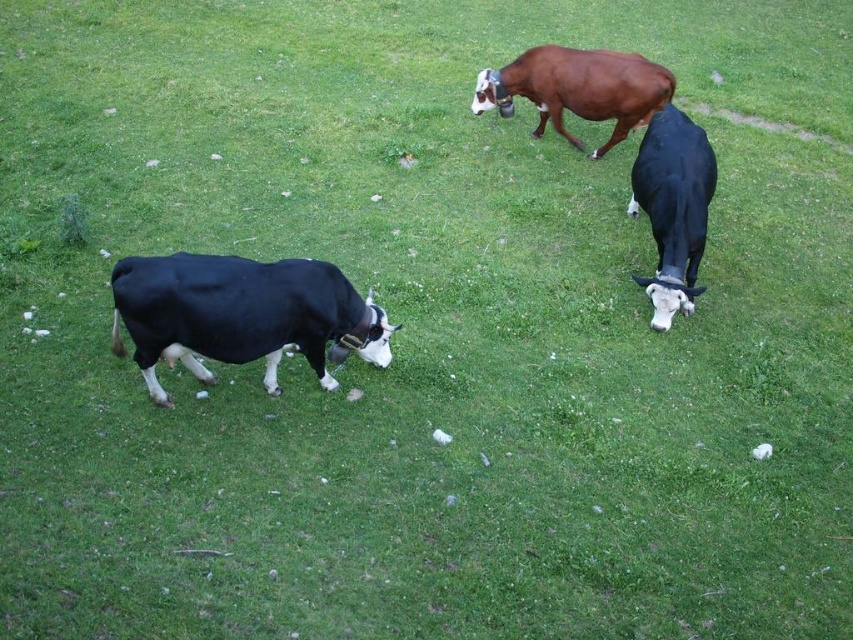
You are a farmer who needs to separate the black smooth cow at left and the brown glossy cow at upper center into two different pens. The minimum distance required between the two pens is 3 meters. Based on the current distance between them, can you safely place them in separate pens without violating the distance requirement?

The distance between the black smooth cow at left and the brown glossy cow at upper center is 4.16 meters, which exceeds the minimum required distance of 3 meters. Therefore, you can safely place them in separate pens without violating the distance requirement.

Consider the image. You are a farmer checking the field. You notice two cows in the field. The black smooth cow at left and the black glossy cow at right. Which cow is taller?

The black glossy cow at right is taller than the black smooth cow at left.